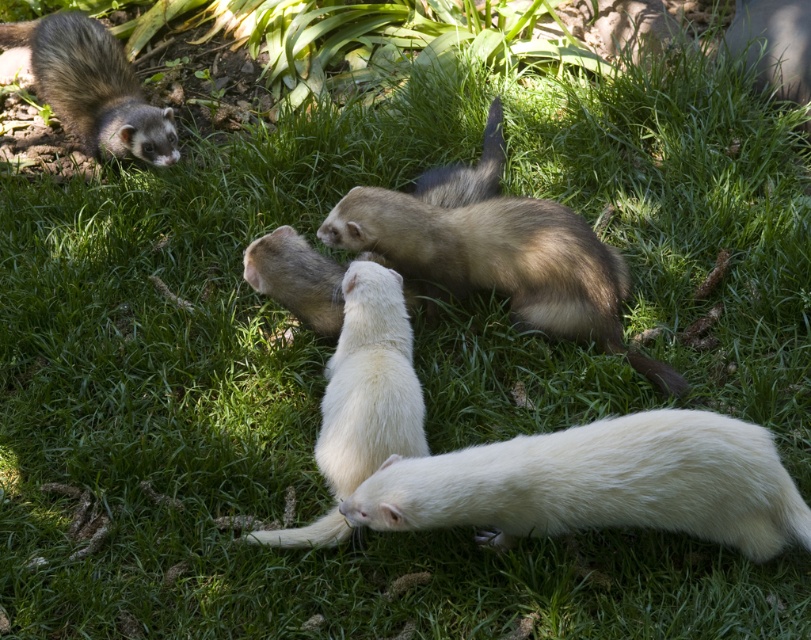
You are a photographer trying to capture a photo of the white fur ferret at lower center and the brown fur ferret at upper left. If you want to ensure both ferrets are fully visible in the frame, which ferret should you focus on first considering their heights?

The white fur ferret at lower center is not as tall as the brown fur ferret at upper left, so you should focus on the brown fur ferret at upper left first to ensure both are in frame.

Looking at this image, you are a ferret owner who wants to ensure your ferret stays within a 10 feet safe zone. Your ferret is currently at the white fur ferret at lower center. Can your ferret reach the edge of the safe zone without crossing it?

The ferret is 8.16 feet away from the edge of the safe zone, so it can reach the edge without crossing it since 8.16 is less than 10 feet.

Based on the photo, you are a photographer aiming to capture a closeup of the white fur ferret at lower center. Given its position at coordinates 0.756, 0.740, where should you position your camera relative to the center of the image to ensure it is in focus?

The white fur ferret at lower center is located at coordinates (x=599, y=483), so you should position your camera slightly to the right and below the center of the image to ensure it is in focus.